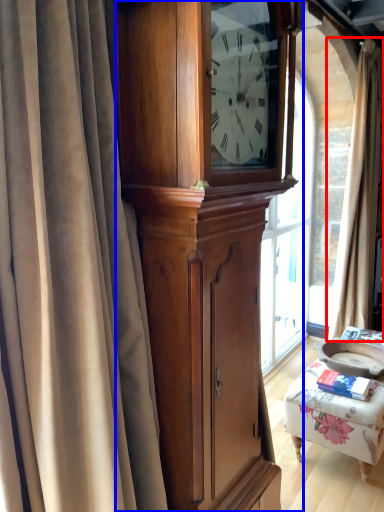
Question: Among these objects, which one is nearest to the camera, curtain (highlighted by a red box) or cabinetry (highlighted by a blue box)?

Choices:
 (A) curtain
 (B) cabinetry

Answer: (B)